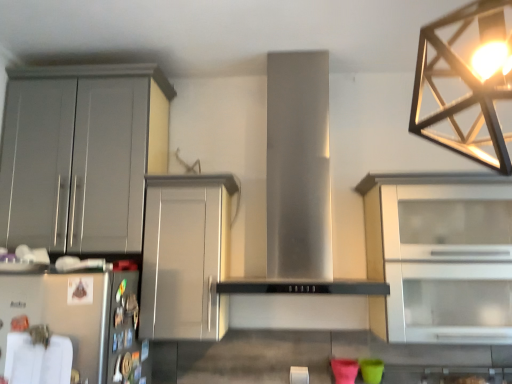
Measure the distance between point (59, 73) and camera.

Point (59, 73) and camera are 5.78 feet apart from each other.

This screenshot has height=384, width=512. Describe the element at coordinates (440, 256) in the screenshot. I see `white glass cabinet at right, which is the 3th cabinetry in left-to-right order` at that location.

Image resolution: width=512 pixels, height=384 pixels. In order to click on metallic geometric light fixture at upper right in this screenshot , I will do `click(467, 83)`.

Identify the location of satin silver cabinet at center, which ranks as the 2th cabinetry in right-to-left order. (186, 256).

Identify the location of matte gray cabinet at left, placed as the 3th cabinetry when sorted from right to left. The width and height of the screenshot is (512, 384). (81, 155).

Which is in front, matte gray cabinet at left, the first cabinetry in the left-to-right sequence, or satin silver cabinet at center, which ranks as the 2th cabinetry in right-to-left order?

satin silver cabinet at center, which ranks as the 2th cabinetry in right-to-left order, is in front.

Looking at their sizes, would you say matte gray cabinet at left, the first cabinetry in the left-to-right sequence, is wider or thinner than satin silver cabinet at center, which ranks as the 2th cabinetry in right-to-left order?

Clearly, matte gray cabinet at left, the first cabinetry in the left-to-right sequence, has less width compared to satin silver cabinet at center, which ranks as the 2th cabinetry in right-to-left order.

Would you say matte gray cabinet at left, placed as the 3th cabinetry when sorted from right to left, is a long distance from satin silver cabinet at center, the second cabinetry when ordered from left to right?

That's not correct — matte gray cabinet at left, placed as the 3th cabinetry when sorted from right to left, is a little close to satin silver cabinet at center, the second cabinetry when ordered from left to right.

Considering the relative sizes of matte gray cabinet at left, the first cabinetry in the left-to-right sequence, and stainless steel hood at center in the image provided, is matte gray cabinet at left, the first cabinetry in the left-to-right sequence, wider than stainless steel hood at center?

No.

Are matte gray cabinet at left, placed as the 3th cabinetry when sorted from right to left, and stainless steel hood at center located far from each other?

No, matte gray cabinet at left, placed as the 3th cabinetry when sorted from right to left, is in close proximity to stainless steel hood at center.

From a real-world perspective, which is physically below, matte gray cabinet at left, placed as the 3th cabinetry when sorted from right to left, or stainless steel hood at center?

From a 3D spatial view, stainless steel hood at center is below.

From the image's perspective, is matte gray cabinet at left, the first cabinetry in the left-to-right sequence, positioned above or below stainless steel hood at center?

matte gray cabinet at left, the first cabinetry in the left-to-right sequence, is above stainless steel hood at center.

From the image's perspective, relative to matte gray cabinet at left, the first cabinetry in the left-to-right sequence, is white glass cabinet at right, which is the 3th cabinetry in left-to-right order, above or below?

Clearly, from the image's perspective, white glass cabinet at right, which is the 3th cabinetry in left-to-right order, is below matte gray cabinet at left, the first cabinetry in the left-to-right sequence.

Based on the photo, who is shorter, white glass cabinet at right, which is the 3th cabinetry in left-to-right order, or matte gray cabinet at left, the first cabinetry in the left-to-right sequence?

white glass cabinet at right, which is the 3th cabinetry in left-to-right order, is shorter.

Considering the sizes of objects white glass cabinet at right, which is the first cabinetry in right-to-left order, and matte gray cabinet at left, the first cabinetry in the left-to-right sequence, in the image provided, who is bigger, white glass cabinet at right, which is the first cabinetry in right-to-left order, or matte gray cabinet at left, the first cabinetry in the left-to-right sequence,?

Bigger between the two is white glass cabinet at right, which is the first cabinetry in right-to-left order.

Which object is further away from the camera, white glass cabinet at right, which is the first cabinetry in right-to-left order, or matte gray cabinet at left, placed as the 3th cabinetry when sorted from right to left?

matte gray cabinet at left, placed as the 3th cabinetry when sorted from right to left, is behind.

Which object is closer to the camera taking this photo, satin silver cabinet at center, which ranks as the 2th cabinetry in right-to-left order, or matte gray cabinet at left, placed as the 3th cabinetry when sorted from right to left?

satin silver cabinet at center, which ranks as the 2th cabinetry in right-to-left order.

Is matte gray cabinet at left, placed as the 3th cabinetry when sorted from right to left, completely or partially inside satin silver cabinet at center, which ranks as the 2th cabinetry in right-to-left order?

No, satin silver cabinet at center, which ranks as the 2th cabinetry in right-to-left order, does not contain matte gray cabinet at left, placed as the 3th cabinetry when sorted from right to left.

In the scene shown: In terms of height, does satin silver cabinet at center, the second cabinetry when ordered from left to right, look taller or shorter compared to matte gray cabinet at left, placed as the 3th cabinetry when sorted from right to left?

Considering their sizes, satin silver cabinet at center, the second cabinetry when ordered from left to right, has less height than matte gray cabinet at left, placed as the 3th cabinetry when sorted from right to left.

What's the angular difference between metallic geometric light fixture at upper right and stainless steel hood at center's facing directions?

metallic geometric light fixture at upper right and stainless steel hood at center are facing 90 degrees away from each other.

Is metallic geometric light fixture at upper right located outside stainless steel hood at center?

Absolutely, metallic geometric light fixture at upper right is external to stainless steel hood at center.

This screenshot has height=384, width=512. In the image, there is a metallic geometric light fixture at upper right. Find the location of `hood below it (from a real-world perspective)`. hood below it (from a real-world perspective) is located at coordinates (298, 184).

Can you confirm if satin silver cabinet at center, which ranks as the 2th cabinetry in right-to-left order, is shorter than white glass cabinet at right, which is the first cabinetry in right-to-left order?

Yes.

Is satin silver cabinet at center, the second cabinetry when ordered from left to right, positioned with its back to white glass cabinet at right, which is the 3th cabinetry in left-to-right order?

No.

Is satin silver cabinet at center, the second cabinetry when ordered from left to right, far from white glass cabinet at right, which is the first cabinetry in right-to-left order?

No, satin silver cabinet at center, the second cabinetry when ordered from left to right, is not far from white glass cabinet at right, which is the first cabinetry in right-to-left order.

Can you confirm if satin silver cabinet at center, which ranks as the 2th cabinetry in right-to-left order, is thinner than white glass cabinet at right, which is the first cabinetry in right-to-left order?

Correct, the width of satin silver cabinet at center, which ranks as the 2th cabinetry in right-to-left order, is less than that of white glass cabinet at right, which is the first cabinetry in right-to-left order.

Which point is more forward, (267, 261) or (501, 250)?

The point (501, 250) is closer to the camera.

From the image's perspective, who appears lower, stainless steel hood at center or white glass cabinet at right, which is the first cabinetry in right-to-left order?

white glass cabinet at right, which is the first cabinetry in right-to-left order, appears lower in the image.

Is stainless steel hood at center not near white glass cabinet at right, which is the first cabinetry in right-to-left order?

No, there isn't a large distance between stainless steel hood at center and white glass cabinet at right, which is the first cabinetry in right-to-left order.

Looking at this image, does stainless steel hood at center have a larger size compared to white glass cabinet at right, which is the first cabinetry in right-to-left order?

Yes, stainless steel hood at center is bigger than white glass cabinet at right, which is the first cabinetry in right-to-left order.

This screenshot has width=512, height=384. What are the coordinates of `cabinetry located behind the satin silver cabinet at center, the second cabinetry when ordered from left to right` in the screenshot? It's located at (81, 155).

Image resolution: width=512 pixels, height=384 pixels. There is a stainless steel hood at center. What are the coordinates of `cabinetry above it (from a real-world perspective)` in the screenshot? It's located at (81, 155).

Estimate the real-world distances between objects in this image. Which object is closer to matte gray cabinet at left, the first cabinetry in the left-to-right sequence, metallic geometric light fixture at upper right or stainless steel hood at center?

Among the two, stainless steel hood at center is located nearer to matte gray cabinet at left, the first cabinetry in the left-to-right sequence.

Considering their positions, is metallic geometric light fixture at upper right positioned closer to satin silver cabinet at center, which ranks as the 2th cabinetry in right-to-left order, than stainless steel hood at center?

stainless steel hood at center is closer to satin silver cabinet at center, which ranks as the 2th cabinetry in right-to-left order.

Considering their positions, is matte gray cabinet at left, the first cabinetry in the left-to-right sequence, positioned further to satin silver cabinet at center, which ranks as the 2th cabinetry in right-to-left order, than stainless steel hood at center?

stainless steel hood at center is further to satin silver cabinet at center, which ranks as the 2th cabinetry in right-to-left order.

Estimate the real-world distances between objects in this image. Which object is closer to matte gray cabinet at left, placed as the 3th cabinetry when sorted from right to left, white glass cabinet at right, which is the 3th cabinetry in left-to-right order, or stainless steel hood at center?

Based on the image, stainless steel hood at center appears to be nearer to matte gray cabinet at left, placed as the 3th cabinetry when sorted from right to left.

Which object lies nearer to the anchor point satin silver cabinet at center, which ranks as the 2th cabinetry in right-to-left order, white glass cabinet at right, which is the first cabinetry in right-to-left order, or stainless steel hood at center?

Among the two, stainless steel hood at center is located nearer to satin silver cabinet at center, which ranks as the 2th cabinetry in right-to-left order.

When comparing their distances from stainless steel hood at center, does matte gray cabinet at left, placed as the 3th cabinetry when sorted from right to left, or satin silver cabinet at center, the second cabinetry when ordered from left to right, seem closer?

Among the two, satin silver cabinet at center, the second cabinetry when ordered from left to right, is located nearer to stainless steel hood at center.

Considering their positions, is metallic geometric light fixture at upper right positioned closer to satin silver cabinet at center, which ranks as the 2th cabinetry in right-to-left order, than matte gray cabinet at left, placed as the 3th cabinetry when sorted from right to left?

Among the two, matte gray cabinet at left, placed as the 3th cabinetry when sorted from right to left, is located nearer to satin silver cabinet at center, which ranks as the 2th cabinetry in right-to-left order.

Based on their spatial positions, is stainless steel hood at center or white glass cabinet at right, which is the 3th cabinetry in left-to-right order, further from satin silver cabinet at center, which ranks as the 2th cabinetry in right-to-left order?

Based on the image, white glass cabinet at right, which is the 3th cabinetry in left-to-right order, appears to be further to satin silver cabinet at center, which ranks as the 2th cabinetry in right-to-left order.

Find the location of a particular element. This screenshot has height=384, width=512. cabinetry between matte gray cabinet at left, the first cabinetry in the left-to-right sequence, and stainless steel hood at center, in the horizontal direction is located at coordinates (186, 256).

You are a GUI agent. You are given a task and a screenshot of the screen. Output one action in this format:
    pyautogui.click(x=<x>, y=<y>)
    Task: Click on the hood positioned between metallic geometric light fixture at upper right and satin silver cabinet at center, the second cabinetry when ordered from left to right, from near to far
    
    Given the screenshot: What is the action you would take?
    pyautogui.click(x=298, y=184)

You are a GUI agent. You are given a task and a screenshot of the screen. Output one action in this format:
    pyautogui.click(x=<x>, y=<y>)
    Task: Click on the cabinetry between matte gray cabinet at left, the first cabinetry in the left-to-right sequence, and white glass cabinet at right, which is the first cabinetry in right-to-left order, from left to right
    
    Given the screenshot: What is the action you would take?
    pyautogui.click(x=186, y=256)

Find the location of a particular element. The height and width of the screenshot is (384, 512). hood situated between matte gray cabinet at left, the first cabinetry in the left-to-right sequence, and metallic geometric light fixture at upper right from left to right is located at coordinates (298, 184).